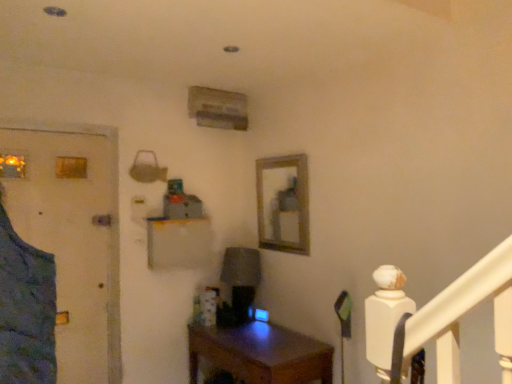
Question: Considering the positions of point (291, 201) and point (86, 342), is point (291, 201) closer or farther from the camera than point (86, 342)?

Choices:
 (A) farther
 (B) closer

Answer: (A)

Question: Is wooden frame at center in front of or behind blue fabric door at left in the image?

Choices:
 (A) behind
 (B) front

Answer: (A)

Question: Based on their relative distances, which object is nearer to the blue fabric door at left?

Choices:
 (A) wooden frame at center
 (B) wooden desk at center

Answer: (B)

Question: Which object is the closest to the blue fabric door at left?

Choices:
 (A) wooden desk at center
 (B) wooden frame at center

Answer: (A)